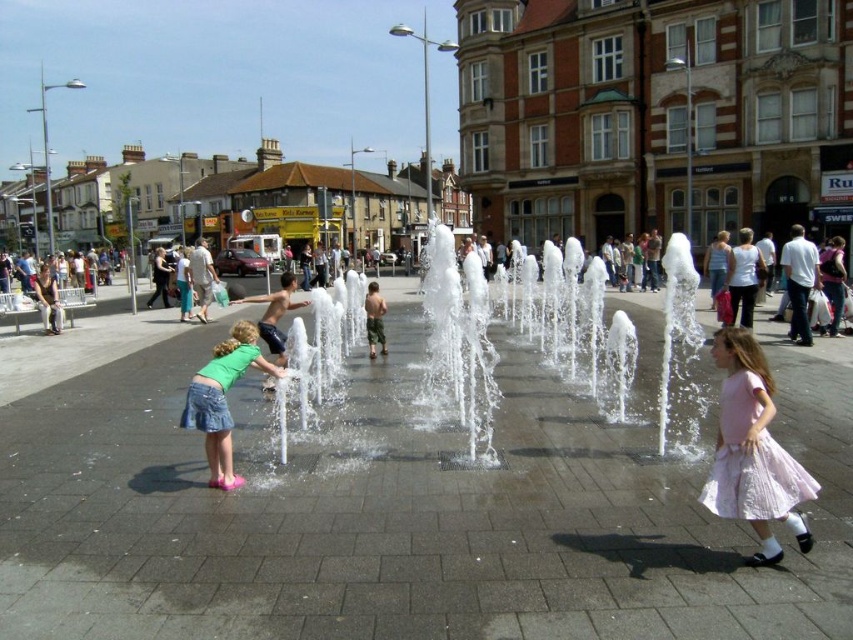
Question: Is clear water jets at center positioned in front of pink pleated skirt at lower right?

Choices:
 (A) no
 (B) yes

Answer: (A)

Question: Does pink pleated skirt at lower right appear under light blue denim skirt at center?

Choices:
 (A) yes
 (B) no

Answer: (A)

Question: Considering the real-world distances, which object is farthest from the clear water jets at center?

Choices:
 (A) white cotton tank top at center
 (B) light blue denim skirt at center
 (C) green camouflage shorts at center

Answer: (B)

Question: Estimate the real-world distances between objects in this image. Which object is farther from the pink pleated skirt at lower right?

Choices:
 (A) green camouflage shorts at center
 (B) denim skirt at lower left
 (C) white cotton tank top at center

Answer: (C)

Question: Does denim skirt at lower left appear on the right side of white cotton tank top at center?

Choices:
 (A) yes
 (B) no

Answer: (B)

Question: Which object is farther from the camera taking this photo?

Choices:
 (A) pink pleated skirt at lower right
 (B) light blue denim skirt at center
 (C) white cotton tank top at center
 (D) green camouflage shorts at center

Answer: (B)